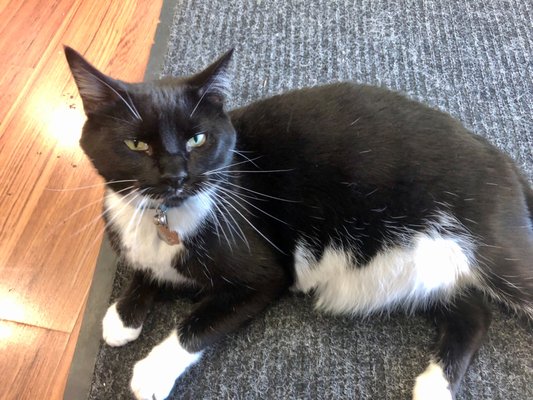
Where is `carpet`? carpet is located at coordinates (320, 55).